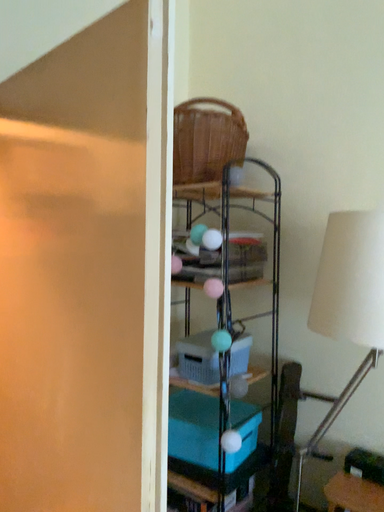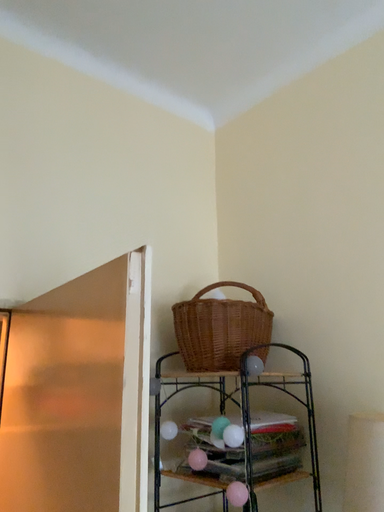
Question: Which way did the camera rotate in the video?

Choices:
 (A) rotated downward
 (B) rotated upward

Answer: (B)